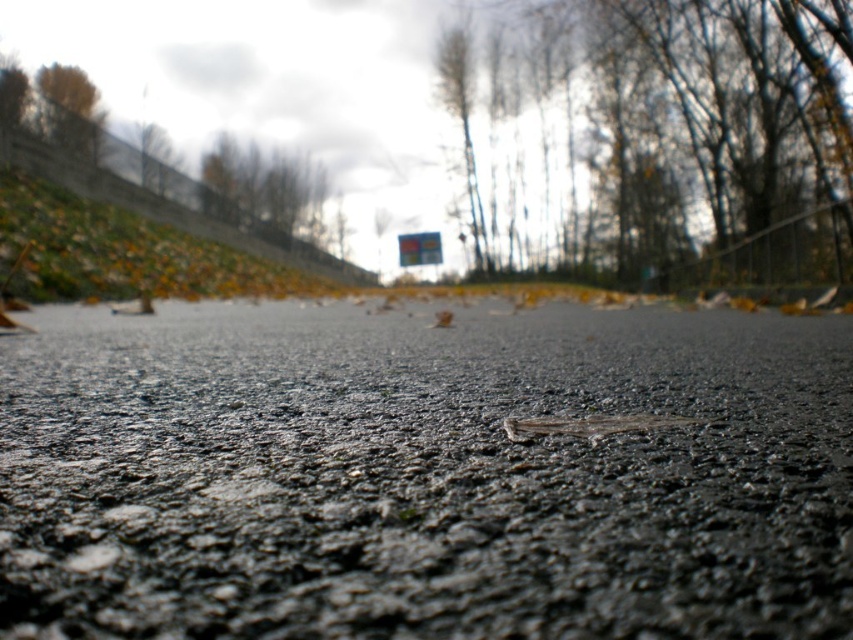
Looking at this image, you are standing on the road looking towards the distant trees. Which object, the black asphalt gravel at center or the bare branches at upper center, is closer to you?

The black asphalt gravel at center is closer to you because it is in front of the bare branches at upper center.

You are standing on the road and looking towards the distant trees. Where are the bare branches at upper center located in relation to your viewpoint?

The bare branches at upper center are located at point (708, 125) in the image.